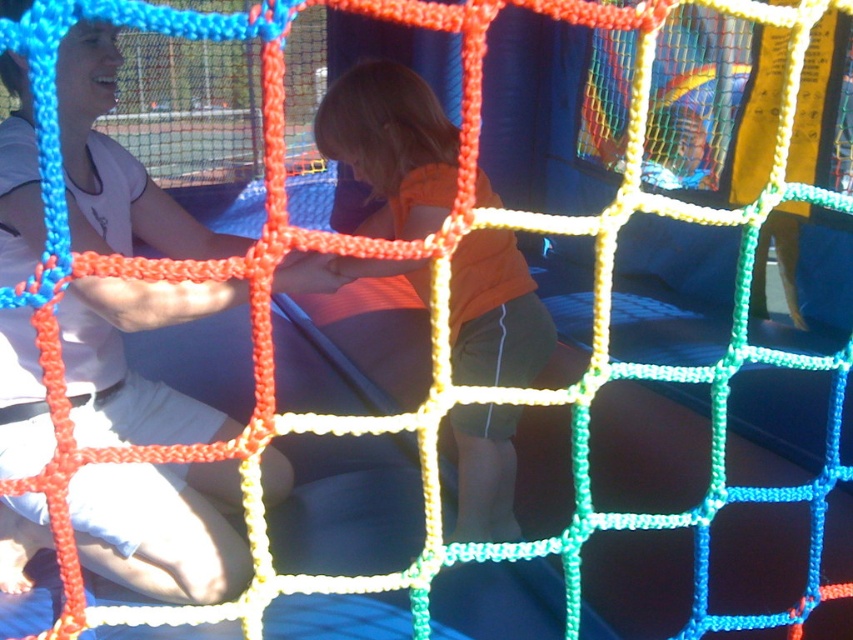
You are standing outside the netting structure and want to hand a toy to both the matte white shirt at center and the orange cotton shirt at center. Which one should you hand the toy to first based on their proximity to you?

You should hand the toy to the matte white shirt at center first because it is closer to you than the orange cotton shirt at center.

You are designing a new playground and want to ensure that the netting structure allows for clear visibility between the two shirts. Given that the netting has a grid pattern with 10 cm spacing between strands, can both the matte white shirt at center and the orange cotton shirt at center be seen clearly through the netting?

The matte white shirt at center has a larger width than the orange cotton shirt at center. Since the netting has 10 cm spacing between strands, the visibility depends on the shirts width. If the shirts are wider than 10 cm, parts of them may be obscured by the netting strands. However, without knowing the exact width of the shirts, it is impossible to determine if they can be seen clearly through the netting.

You are standing in a playground and see two shirts through the colorful netting. The matte white shirt at center and the orange cotton shirt at center. Which shirt is shorter in height?

The matte white shirt at center is shorter in height compared to the orange cotton shirt at center.